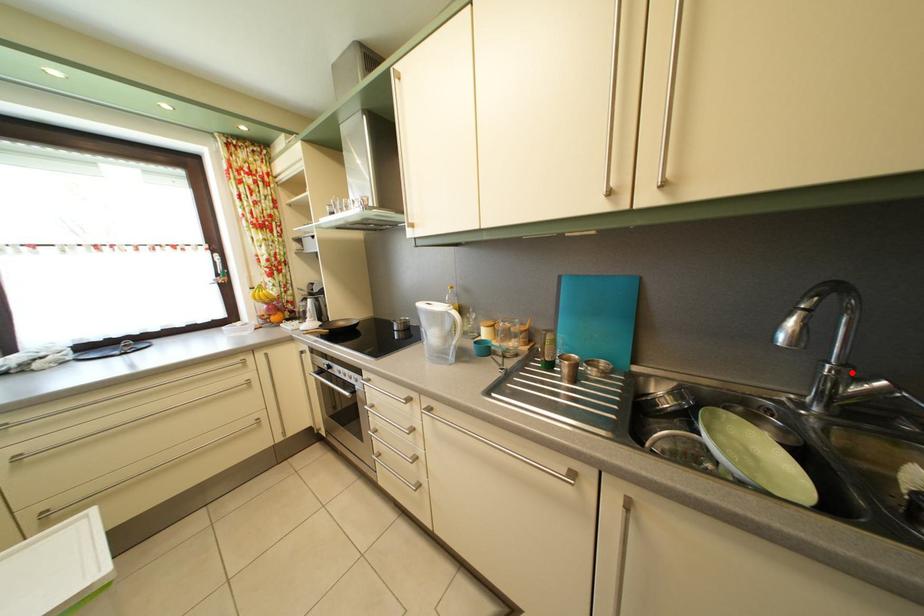
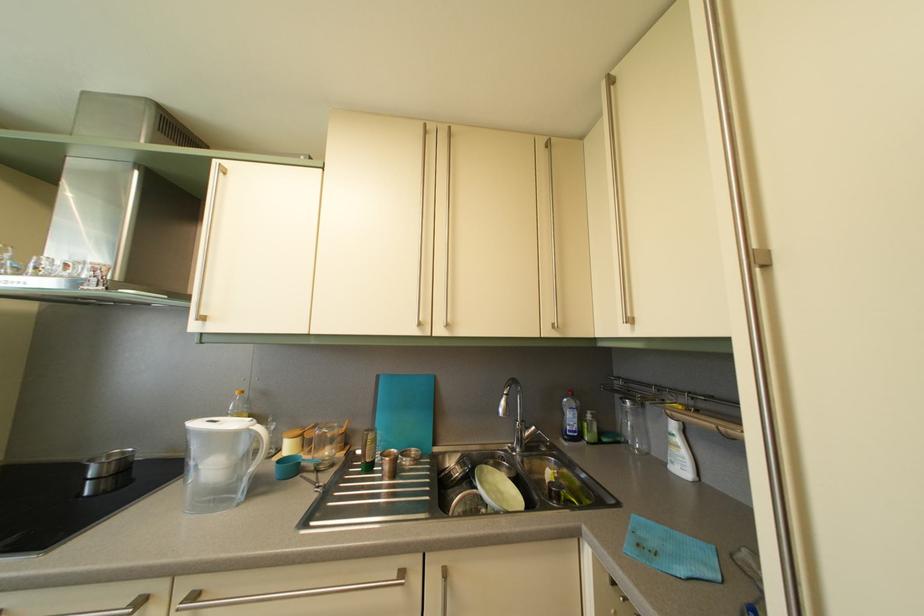
Question: I am providing you with two images of the same scene from different viewpoints. Given a red point in image1, look at the same physical point in image2. Is it:

Choices:
 (A) Closer to the viewpoint
 (B) Farther from the viewpoint

Answer: (B)